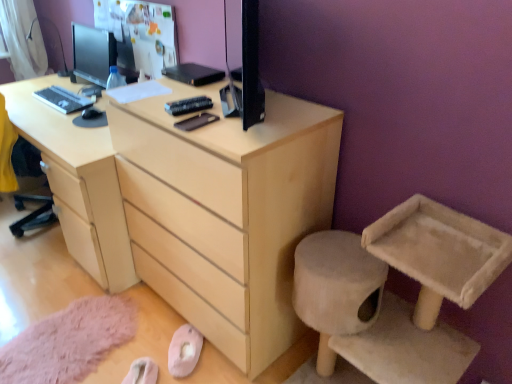
In order to click on free space to the back side of matte black keyboard at left in this screenshot , I will do coord(64,83).